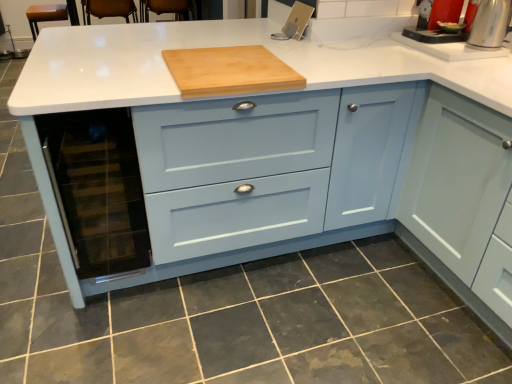
Question: Considering their positions, is satin silver kettle at upper right located in front of or behind natural wood cutting board at center?

Choices:
 (A) behind
 (B) front

Answer: (A)

Question: Is satin silver kettle at upper right bigger or smaller than natural wood cutting board at center?

Choices:
 (A) big
 (B) small

Answer: (B)

Question: Considering the real-world distances, which object is farthest from the transparent glass wine cooler at lower left?

Choices:
 (A) dark gray tile at lower center
 (B) natural wood cutting board at center
 (C) satin silver kettle at upper right
 (D) white glossy sink at upper right

Answer: (C)

Question: Which object is positioned farthest from the satin silver kettle at upper right?

Choices:
 (A) transparent glass wine cooler at lower left
 (B) dark gray tile at lower center
 (C) natural wood cutting board at center
 (D) white glossy sink at upper right

Answer: (A)